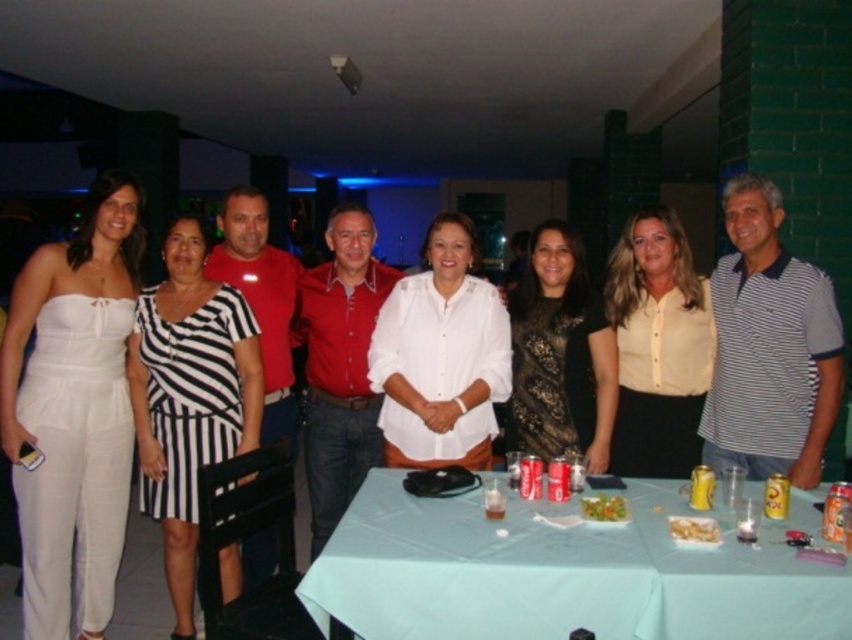
Question: Which object appears farthest from the camera in this image?

Choices:
 (A) white matte shirt at center
 (B) black lace dress at center
 (C) green leafy salad at center

Answer: (B)

Question: Does white satin jumpsuit at left have a smaller size compared to black lace dress at center?

Choices:
 (A) yes
 (B) no

Answer: (B)

Question: Which object is positioned farthest from the black lace dress at center?

Choices:
 (A) white matte shirt at center
 (B) green leafy salad at center

Answer: (B)

Question: From the image, what is the correct spatial relationship of black and white striped dress at center in relation to black lace dress at center?

Choices:
 (A) left
 (B) right

Answer: (A)

Question: Which object appears closest to the camera in this image?

Choices:
 (A) white matte shirt at center
 (B) light blue fabric table at center
 (C) yellow crumbly snack at center
 (D) yellow button-down shirt at center

Answer: (B)

Question: Does red cotton shirt at center have a lesser width compared to matte red shirt at center?

Choices:
 (A) yes
 (B) no

Answer: (B)